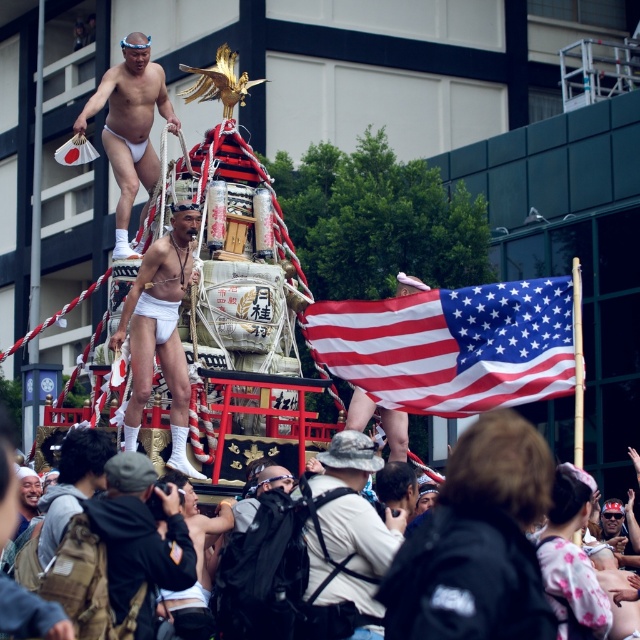
You are a photographer at the festival. You want to take a photo of the white matte underwear at center and the black leather jacket at lower center. Which object should you zoom in on to capture more detail without changing the camera position?

The white matte underwear at center is smaller than the black leather jacket at lower center, so you should zoom in on the white matte underwear at center to capture more detail.

You are a photographer at the festival. You want to take a photo of the black leather jacket at lower center and the american flag at right. Which object is positioned farther to the right in the image?

The american flag at right is positioned farther to the right than the black leather jacket at lower center.